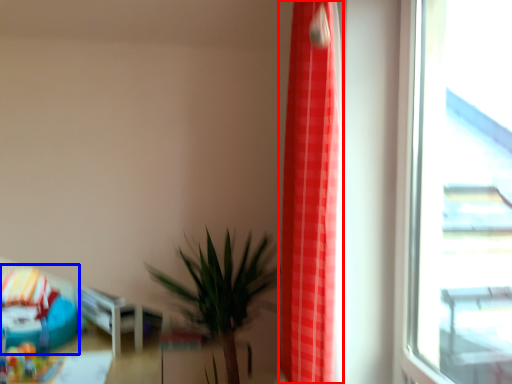
Question: Which point is closer to the camera, curtain (highlighted by a red box) or bean bag chair (highlighted by a blue box)?

Choices:
 (A) curtain
 (B) bean bag chair

Answer: (A)